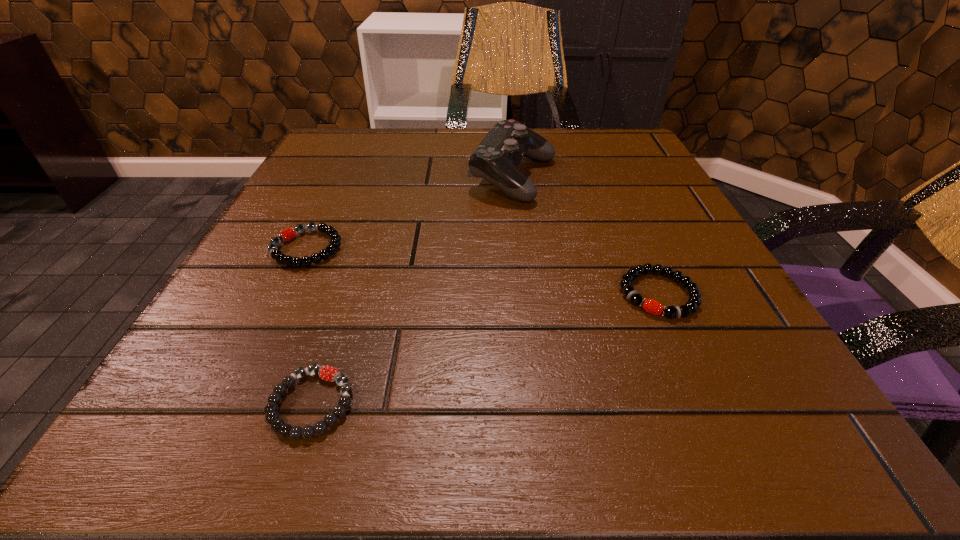
Where is `the tallest object`? Image resolution: width=960 pixels, height=540 pixels. the tallest object is located at coordinates (496, 159).

This screenshot has width=960, height=540. I want to click on the third object from left to right, so click(496, 159).

This screenshot has width=960, height=540. In order to click on the rightmost bracelet in this screenshot , I will do `click(651, 306)`.

Locate an element on the screen. the nearest bracelet is located at coordinates (328, 373).

You are a GUI agent. You are given a task and a screenshot of the screen. Output one action in this format:
    pyautogui.click(x=<x>, y=<y>)
    Task: Click on the shortest object
    
    Given the screenshot: What is the action you would take?
    pyautogui.click(x=328, y=373)

Locate an element on the screen. This screenshot has width=960, height=540. vacant space located 0.340m on the front of the tallest object is located at coordinates (535, 358).

Where is `vacant space situated on the front of the rightmost object`? vacant space situated on the front of the rightmost object is located at coordinates click(x=732, y=462).

Where is `vacant space located on the back of the nearest object`? Image resolution: width=960 pixels, height=540 pixels. vacant space located on the back of the nearest object is located at coordinates (379, 198).

Find the location of a particular element. object that is positioned at the far edge is located at coordinates (496, 159).

In order to click on object at the near edge in this screenshot , I will do `click(328, 373)`.